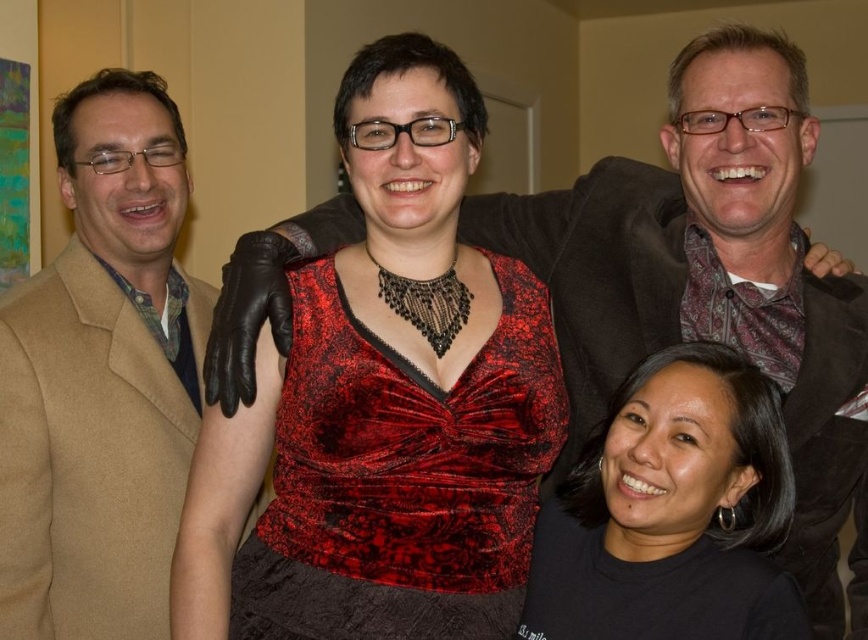
Question: Considering the relative positions of matte black jacket at upper right and tan woolen jacket at left in the image provided, where is matte black jacket at upper right located with respect to tan woolen jacket at left?

Choices:
 (A) left
 (B) right

Answer: (B)

Question: Which object is farther from the camera taking this photo?

Choices:
 (A) tan woolen jacket at left
 (B) black matte shirt at lower right
 (C) matte black jacket at upper right

Answer: (A)

Question: In this image, where is tan woolen jacket at left located relative to black matte shirt at lower right?

Choices:
 (A) right
 (B) left

Answer: (B)

Question: Is matte black jacket at upper right smaller than tan woolen jacket at left?

Choices:
 (A) yes
 (B) no

Answer: (B)

Question: Which point is closer to the camera?

Choices:
 (A) matte black jacket at upper right
 (B) velvet/red dress at center

Answer: (B)

Question: Which point is farther to the camera?

Choices:
 (A) matte black jacket at upper right
 (B) black matte shirt at lower right
 (C) velvet/red dress at center

Answer: (A)